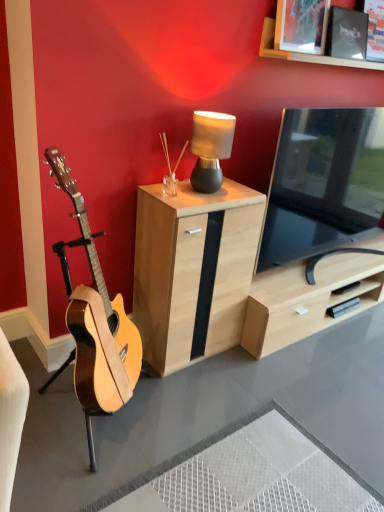
Question: Is natural wood guitar at left looking in the opposite direction of black glossy tv at right?

Choices:
 (A) yes
 (B) no

Answer: (B)

Question: Is natural wood guitar at left oriented towards black glossy tv at right?

Choices:
 (A) no
 (B) yes

Answer: (A)

Question: Does natural wood guitar at left come in front of black glossy tv at right?

Choices:
 (A) yes
 (B) no

Answer: (A)

Question: Considering the relative positions of natural wood guitar at left and black glossy tv at right in the image provided, is natural wood guitar at left behind black glossy tv at right?

Choices:
 (A) no
 (B) yes

Answer: (A)

Question: From a real-world perspective, is natural wood guitar at left over black glossy tv at right?

Choices:
 (A) yes
 (B) no

Answer: (B)

Question: From the image's perspective, is black glossy tv at right positioned above or below wooden picture frame at upper right, the 2th picture frame positioned from the right?

Choices:
 (A) below
 (B) above

Answer: (A)

Question: Considering the relative positions of black glossy tv at right and wooden picture frame at upper right, the 2th picture frame positioned from the right, in the image provided, is black glossy tv at right to the left or to the right of wooden picture frame at upper right, the 2th picture frame positioned from the right,?

Choices:
 (A) right
 (B) left

Answer: (A)

Question: Is black glossy tv at right wider or thinner than wooden picture frame at upper right, which ranks as the first picture frame in left-to-right order?

Choices:
 (A) thin
 (B) wide

Answer: (B)

Question: In terms of height, does black glossy tv at right look taller or shorter compared to wooden picture frame at upper right, which ranks as the first picture frame in left-to-right order?

Choices:
 (A) tall
 (B) short

Answer: (A)

Question: Is wooden picture frame at upper right, which ranks as the first picture frame in left-to-right order, inside or outside of matte black picture frame at upper right, the second picture frame when ordered from left to right?

Choices:
 (A) inside
 (B) outside

Answer: (B)

Question: From the image's perspective, is wooden picture frame at upper right, the 2th picture frame positioned from the right, positioned above or below matte black picture frame at upper right, which appears as the first picture frame when viewed from the right?

Choices:
 (A) below
 (B) above

Answer: (A)

Question: Based on their sizes in the image, would you say wooden picture frame at upper right, the 2th picture frame positioned from the right, is bigger or smaller than matte black picture frame at upper right, which appears as the first picture frame when viewed from the right?

Choices:
 (A) small
 (B) big

Answer: (B)

Question: Considering the positions of wooden picture frame at upper right, the 2th picture frame positioned from the right, and matte black picture frame at upper right, which appears as the first picture frame when viewed from the right, in the image, is wooden picture frame at upper right, the 2th picture frame positioned from the right, taller or shorter than matte black picture frame at upper right, which appears as the first picture frame when viewed from the right,?

Choices:
 (A) tall
 (B) short

Answer: (A)

Question: Is black glossy tv at right in front of or behind natural wood guitar at left in the image?

Choices:
 (A) front
 (B) behind

Answer: (B)

Question: Is point (276, 196) closer or farther from the camera than point (97, 375)?

Choices:
 (A) closer
 (B) farther

Answer: (B)